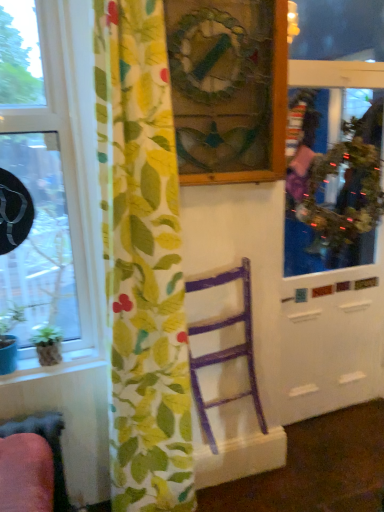
Question: Is floral fabric curtain at left in front of or behind green glossy houseplant at lower left in the image?

Choices:
 (A) behind
 (B) front

Answer: (B)

Question: From a real-world perspective, is floral fabric curtain at left above or below green glossy houseplant at lower left?

Choices:
 (A) below
 (B) above

Answer: (B)

Question: Based on their relative distances, which object is farther from the wooden picture frame at upper center?

Choices:
 (A) green glossy houseplant at lower left
 (B) metallic reflective screen door at right
 (C) green textured wreath at upper right
 (D) purple wood chair at center
 (E) transparent glass window at left

Answer: (A)

Question: Which object is the closest to the green glossy houseplant at lower left?

Choices:
 (A) floral fabric curtain at left
 (B) metallic reflective screen door at right
 (C) green textured wreath at upper right
 (D) transparent glass window at left
 (E) purple wood chair at center

Answer: (D)